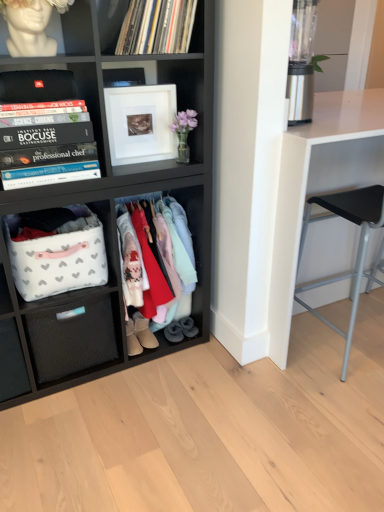
This screenshot has height=512, width=384. Identify the location of vacant area that is in front of beige suede boot at lower center, which appears as the 1th footwear when viewed from the left. (127, 360).